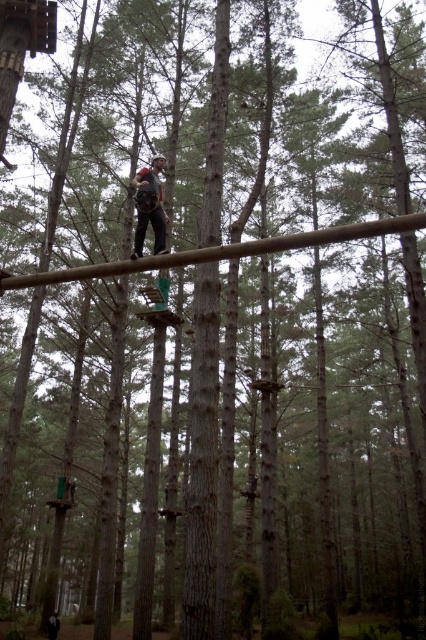
Question: Considering the relative positions of matte gray helmet at center and dark brown leather jacket at lower left in the image provided, where is matte gray helmet at center located with respect to dark brown leather jacket at lower left?

Choices:
 (A) left
 (B) right

Answer: (B)

Question: Is matte gray helmet at center bigger than dark brown leather jacket at lower left?

Choices:
 (A) no
 (B) yes

Answer: (B)

Question: Which point is farther to the camera?

Choices:
 (A) (48, 620)
 (B) (152, 188)

Answer: (A)

Question: Which object is farther from the camera taking this photo?

Choices:
 (A) dark brown leather jacket at lower left
 (B) matte gray helmet at center

Answer: (A)

Question: Does matte gray helmet at center appear on the left side of dark brown leather jacket at lower left?

Choices:
 (A) no
 (B) yes

Answer: (A)